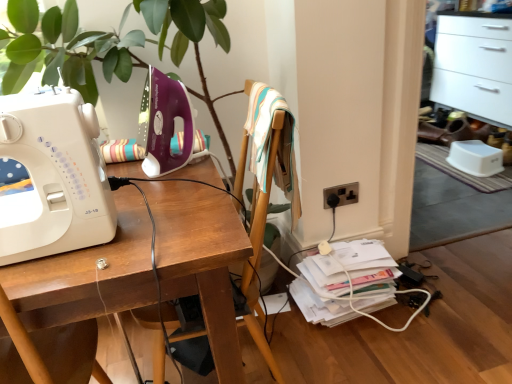
Where is `vacant space behind white plastic sewing machine at left, the 2th sewing machine viewed from the back`? vacant space behind white plastic sewing machine at left, the 2th sewing machine viewed from the back is located at coordinates (134, 184).